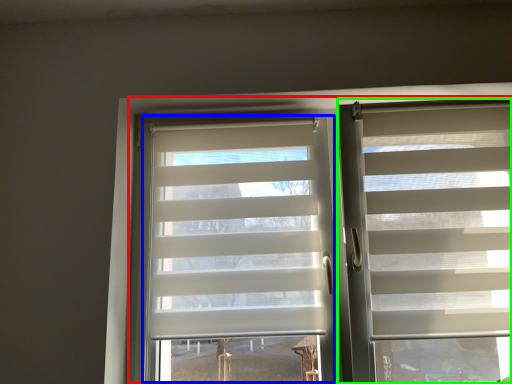
Question: Considering the real-world distances, which object is farthest from bay window (highlighted by a red box)? glass door (highlighted by a blue box) or window blind (highlighted by a green box)?

Choices:
 (A) glass door
 (B) window blind

Answer: (B)